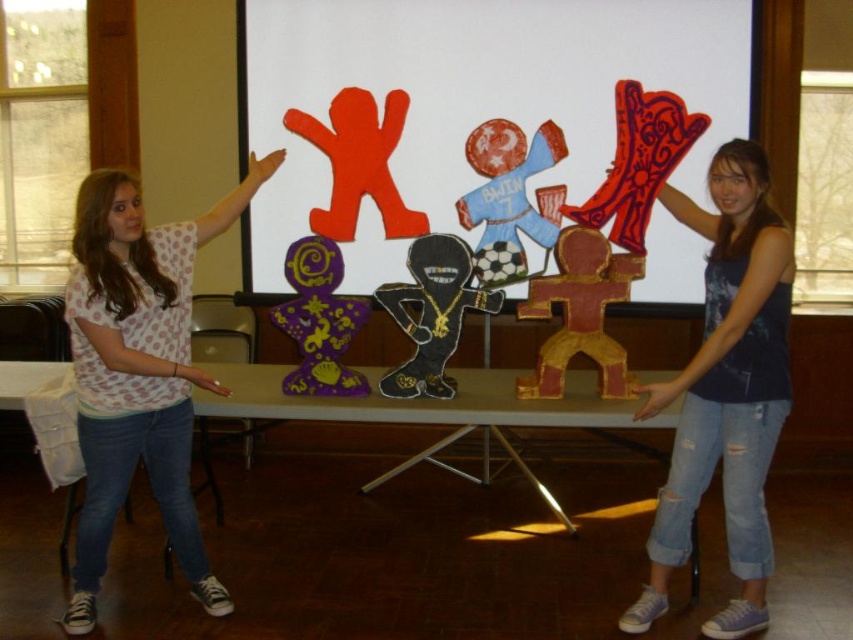
Is blue denim jeans at center behind black felt figure at center?

That is False.

Between point (784, 336) and point (442, 364), which one is positioned in front?

Point (784, 336) is more forward.

Where is `blue denim jeans at center`? This screenshot has height=640, width=853. blue denim jeans at center is located at coordinates click(726, 390).

Who is higher up, white dotted shirt at upper left or matte blue fabric figure at center?

matte blue fabric figure at center is above.

Can you confirm if white dotted shirt at upper left is bigger than matte blue fabric figure at center?

Yes, white dotted shirt at upper left is bigger than matte blue fabric figure at center.

The image size is (853, 640). What are the coordinates of `white dotted shirt at upper left` in the screenshot? It's located at (138, 371).

Can you confirm if white dotted shirt at upper left is positioned above blue denim jeans at center?

Correct, white dotted shirt at upper left is located above blue denim jeans at center.

Based on the photo, who is shorter, white dotted shirt at upper left or blue denim jeans at center?

With less height is blue denim jeans at center.

Between point (163, 403) and point (770, 205), which one is positioned in front?

Point (770, 205) is in front.

Where is `white dotted shirt at upper left`? The height and width of the screenshot is (640, 853). white dotted shirt at upper left is located at coordinates (138, 371).